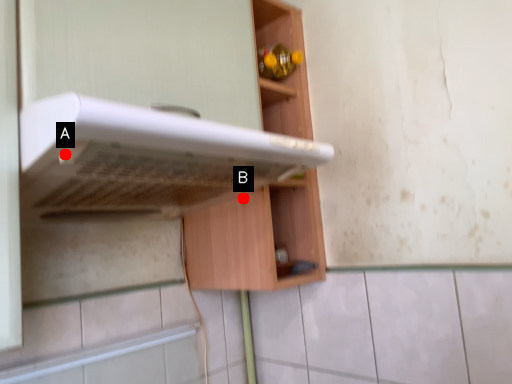
Question: Two points are circled on the image, labeled by A and B beside each circle. Which of the following is the closest to the observer?

Choices:
 (A) A is closer
 (B) B is closer

Answer: (A)